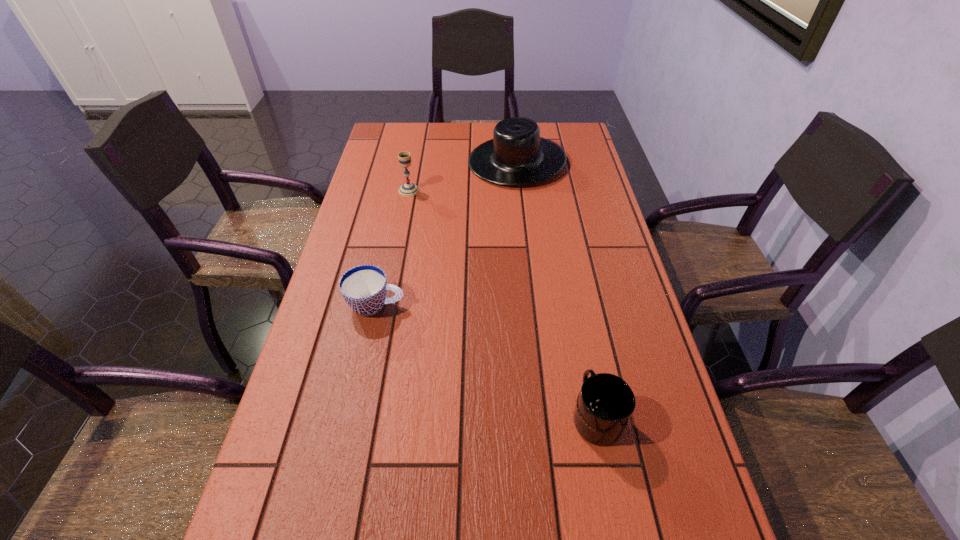
Where is `dress hat`? The width and height of the screenshot is (960, 540). dress hat is located at coordinates (517, 155).

In order to click on chalice in this screenshot , I will do `click(408, 189)`.

Find the location of `the second shortest object`. the second shortest object is located at coordinates (605, 404).

In order to click on mug in this screenshot , I will do `click(605, 404)`.

At what (x,y) coordinates should I click in order to perform the action: click on the shortest object. Please return your answer as a coordinate pair (x, y). This screenshot has width=960, height=540. Looking at the image, I should click on (364, 288).

I want to click on cup, so click(x=364, y=288).

Where is `vacant space located 0.250m on the front of the dress hat`? The image size is (960, 540). vacant space located 0.250m on the front of the dress hat is located at coordinates (525, 241).

You are a GUI agent. You are given a task and a screenshot of the screen. Output one action in this format:
    pyautogui.click(x=<x>, y=<y>)
    Task: Click on the vacant space located on the front of the chalice
    The height and width of the screenshot is (540, 960).
    Given the screenshot: What is the action you would take?
    pyautogui.click(x=400, y=234)

At what (x,y) coordinates should I click in order to perform the action: click on vacant space positioned with the handle on the side of the mug. Please return your answer as a coordinate pair (x, y). Looking at the image, I should click on (577, 316).

Locate an element on the screen. free space located 0.060m with the handle on the side of the mug is located at coordinates (586, 363).